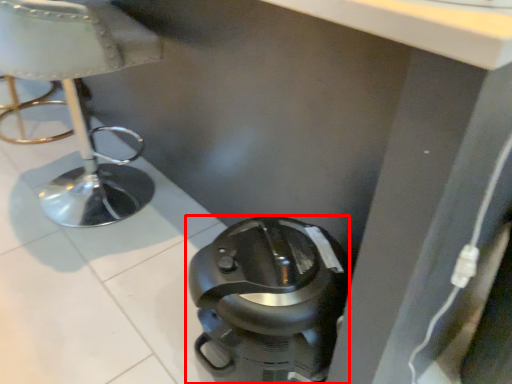
Question: In this image, where is home appliance (annotated by the red box) located relative to furniture?

Choices:
 (A) left
 (B) right

Answer: (B)